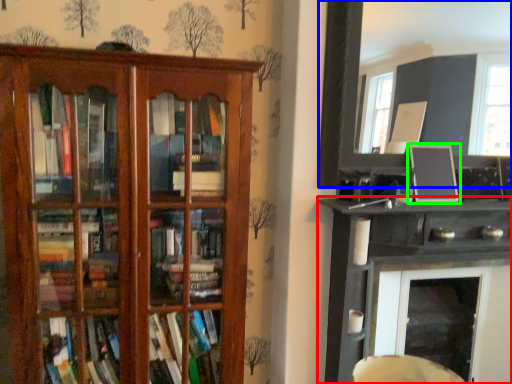
Question: Which object is positioned farthest from shelf (highlighted by a red box)? Select from picture frame (highlighted by a blue box) and picture frame (highlighted by a green box).

Choices:
 (A) picture frame
 (B) picture frame

Answer: (A)